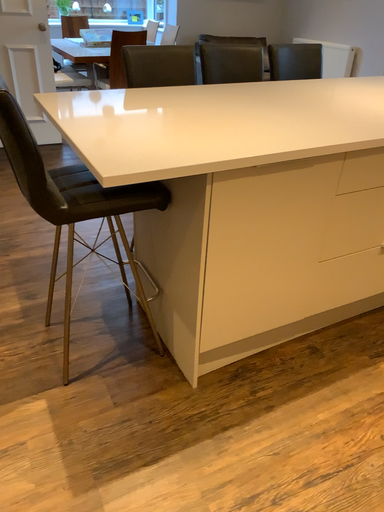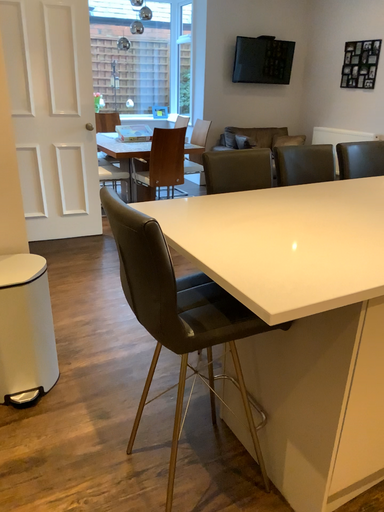
Question: How did the camera likely rotate when shooting the video?

Choices:
 (A) rotated upward
 (B) rotated downward

Answer: (A)